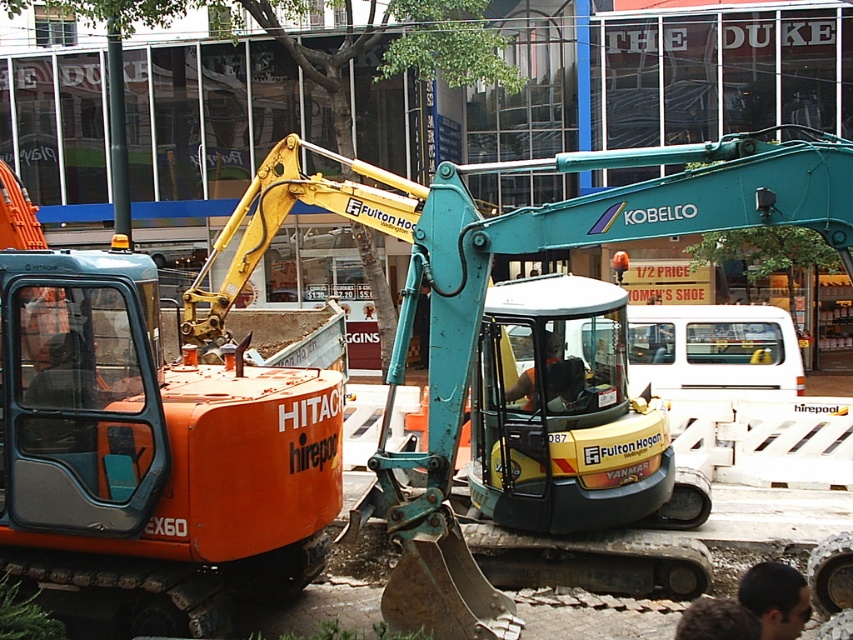
Can you confirm if dark brown hair at lower right is wider than orange fabric shirt at center?

Incorrect, dark brown hair at lower right's width does not surpass orange fabric shirt at center's.

Locate an element on the screen. This screenshot has width=853, height=640. dark brown hair at lower right is located at coordinates (775, 598).

Is point (831, 232) positioned after point (520, 394)?

No, (831, 232) is in front of (520, 394).

Does teal metallic excavator at center appear on the left side of orange fabric shirt at center?

No, teal metallic excavator at center is not to the left of orange fabric shirt at center.

Consider the image. Who is more distant from viewer, (445, 520) or (549, 340)?

The point (549, 340) is more distant.

The image size is (853, 640). What are the coordinates of `teal metallic excavator at center` in the screenshot? It's located at (485, 296).

Which is behind, point (360, 170) or point (784, 618)?

Point (360, 170)

Find the location of a particular element. This screenshot has height=640, width=853. teal metallic excavator at center is located at coordinates (485, 296).